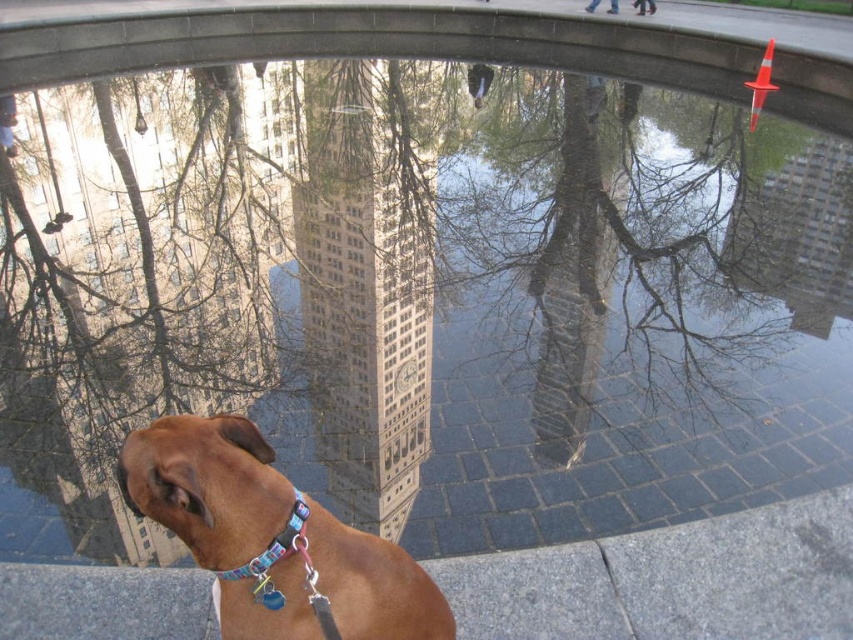
Question: Which of the following is the farthest from the observer?

Choices:
 (A) brown matte dog at center
 (B) multicolored fabric neckband at lower center

Answer: (B)

Question: Which object is positioned closest to the smooth glass water at center?

Choices:
 (A) brown matte dog at center
 (B) multicolored fabric neckband at lower center

Answer: (A)

Question: Which of the following is the closest to the observer?

Choices:
 (A) smooth glass water at center
 (B) brown matte dog at center

Answer: (B)

Question: Is smooth glass water at center below brown matte dog at center?

Choices:
 (A) yes
 (B) no

Answer: (B)

Question: Is brown matte dog at center below multicolored fabric neckband at lower center?

Choices:
 (A) no
 (B) yes

Answer: (B)

Question: Does brown matte dog at center have a larger size compared to multicolored fabric neckband at lower center?

Choices:
 (A) no
 (B) yes

Answer: (B)